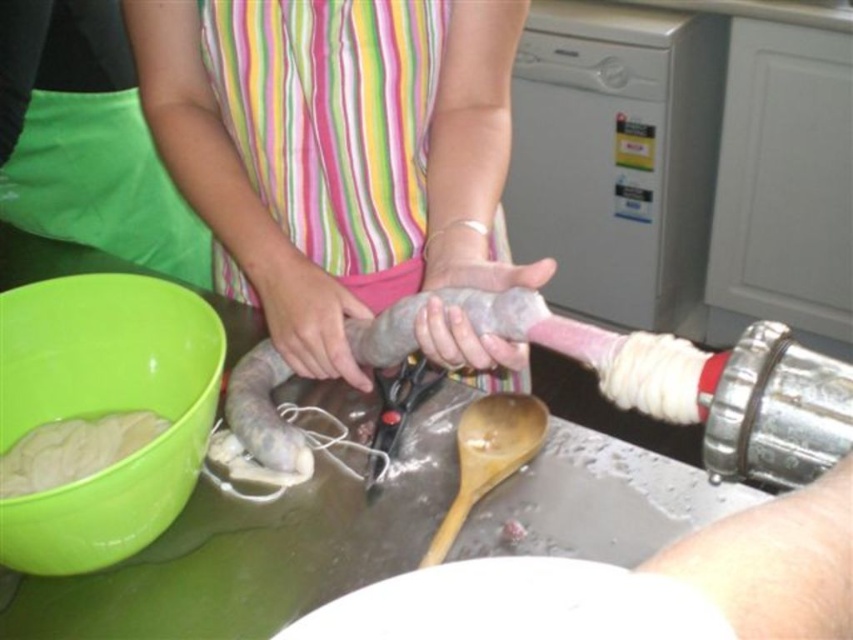
You are helping prepare sausage filling in the kitchen. You have a white matte bowl at lower center and a wooden spoon at center. Which object is wider?

The white matte bowl at lower center is wider than the wooden spoon at center.

You are a chef in a kitchen. You see the pink rubber sausage at center and the white matte bowl at lower center. Which object is positioned higher in the image?

The pink rubber sausage at center is above the white matte bowl at lower center, so it is positioned higher.